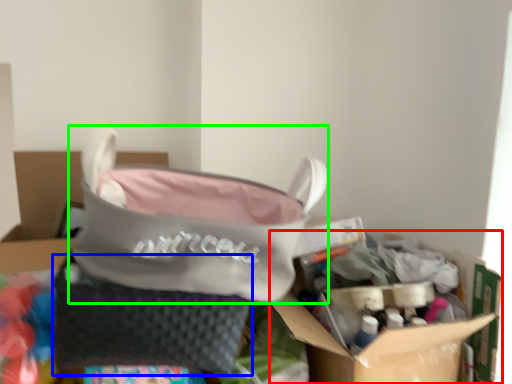
Question: Based on their relative distances, which object is farther from cardboard box (highlighted by a red box)? Choose from pouch (highlighted by a blue box) and handbag (highlighted by a green box).

Choices:
 (A) pouch
 (B) handbag

Answer: (A)